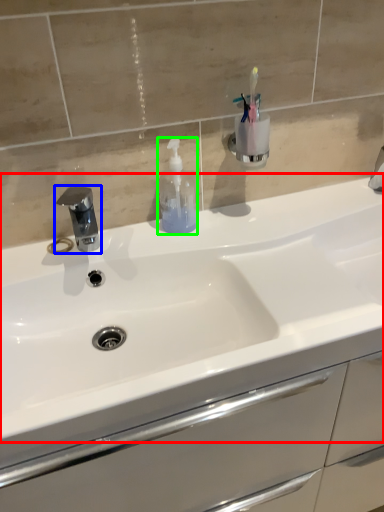
Question: Which object is the closest to the sink (highlighted by a red box)? Choose among these: tap (highlighted by a blue box) or soap dispenser (highlighted by a green box).

Choices:
 (A) tap
 (B) soap dispenser

Answer: (B)